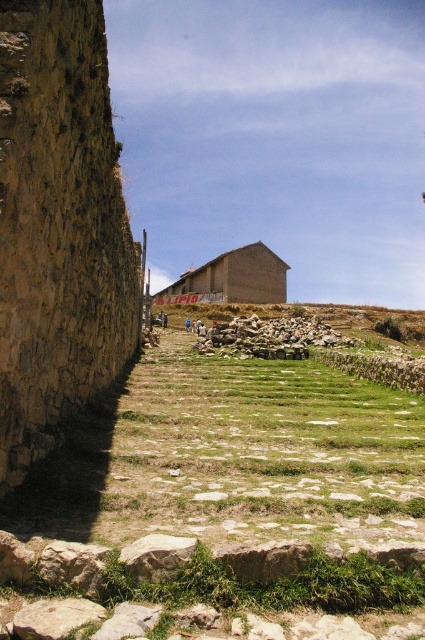
Between brown brick hut at center and rustic stone wall at center, which one appears on the right side from the viewer's perspective?

rustic stone wall at center

From the picture: Does brown brick hut at center appear on the left side of rustic stone wall at center?

Indeed, brown brick hut at center is positioned on the left side of rustic stone wall at center.

Who is more distant from viewer, [260,276] or [303,337]?

Positioned behind is point [260,276].

Where is `brown brick hut at center`? brown brick hut at center is located at coordinates (232, 278).

Is point (325, 340) positioned in front of point (173, 557)?

No, (325, 340) is further to viewer.

Is point (272, 356) more distant than point (161, 540)?

Yes, point (272, 356) is behind point (161, 540).

Identify the location of rustic stone wall at center. This screenshot has height=640, width=425. (269, 337).

Looking at this image, does brown brick hut at center appear on the left side of brown rough rock at lower center?

In fact, brown brick hut at center is to the right of brown rough rock at lower center.

Who is more forward, (269, 291) or (130, 560)?

Point (130, 560) is more forward.

Where is `brown brick hut at center`? The width and height of the screenshot is (425, 640). brown brick hut at center is located at coordinates (232, 278).